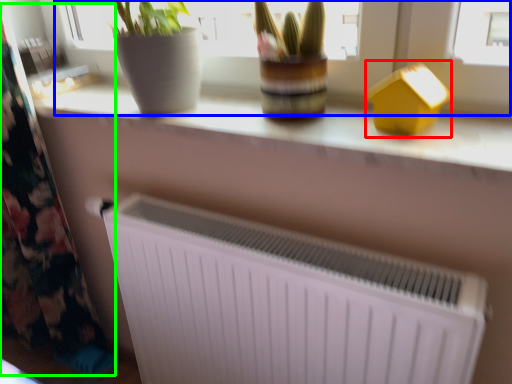
Question: Which object is the closest to the toy (highlighted by a red box)? Choose among these: bay window (highlighted by a blue box) or curtain (highlighted by a green box).

Choices:
 (A) bay window
 (B) curtain

Answer: (A)